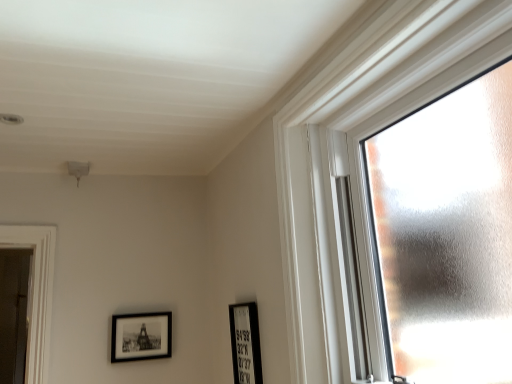
Question: Do you think black matte picture frame at lower center, placed as the 1th picture frame when sorted from front to back, is within frosted glass window at right, or outside of it?

Choices:
 (A) outside
 (B) inside

Answer: (A)

Question: Is black matte picture frame at lower center, placed as the 1th picture frame when sorted from front to back, taller or shorter than frosted glass window at right?

Choices:
 (A) short
 (B) tall

Answer: (A)

Question: Estimate the real-world distances between objects in this image. Which object is closer to the black matte picture frame at lower center, placed as the 1th picture frame when sorted from front to back?

Choices:
 (A) black matte picture frame at lower left, which appears as the 2th picture frame when viewed from the front
 (B) frosted glass window at right

Answer: (A)

Question: Which of these objects is positioned closest to the black matte picture frame at lower left, marked as the 1th picture frame in a left-to-right arrangement?

Choices:
 (A) frosted glass window at right
 (B) black matte picture frame at lower center, the second picture frame when ordered from back to front

Answer: (B)